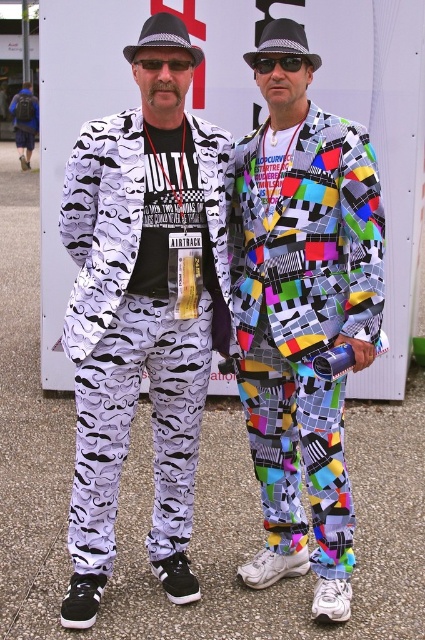
In the scene shown: Between multicolored patchwork suit at center and white mustache-patterned suit at left, which one appears on the left side from the viewer's perspective?

white mustache-patterned suit at left is more to the left.

Does multicolored patchwork suit at center appear under white mustache-patterned suit at left?

Incorrect, multicolored patchwork suit at center is not positioned below white mustache-patterned suit at left.

Image resolution: width=425 pixels, height=640 pixels. Describe the element at coordinates (303, 314) in the screenshot. I see `multicolored patchwork suit at center` at that location.

Find the location of `multicolored patchwork suit at center`. multicolored patchwork suit at center is located at coordinates (303, 314).

Who is more distant from viewer, (x=142, y=321) or (x=303, y=60)?

The point (x=142, y=321) is more distant.

Does point (164, 193) come closer to viewer compared to point (308, 60)?

No.

I want to click on white mustache-patterned suit at left, so click(138, 321).

Does multicolored patchwork suit at center appear on the left side of black plastic sunglasses at center?

No, multicolored patchwork suit at center is not to the left of black plastic sunglasses at center.

The width and height of the screenshot is (425, 640). Describe the element at coordinates (303, 314) in the screenshot. I see `multicolored patchwork suit at center` at that location.

You are a GUI agent. You are given a task and a screenshot of the screen. Output one action in this format:
    pyautogui.click(x=<x>, y=<y>)
    Task: Click on the multicolored patchwork suit at center
    
    Given the screenshot: What is the action you would take?
    pyautogui.click(x=303, y=314)

Find the location of a particular element. multicolored patchwork suit at center is located at coordinates (303, 314).